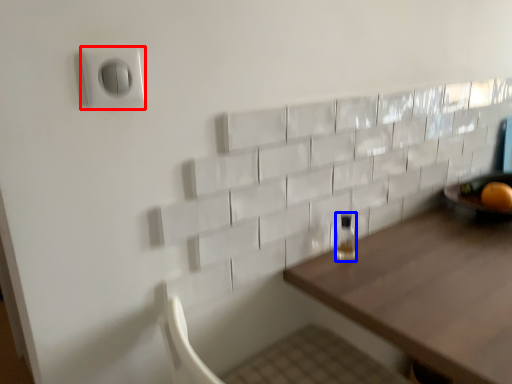
Question: Which object appears closest to the camera in this image, electric outlet (highlighted by a red box) or bottle (highlighted by a blue box)?

Choices:
 (A) electric outlet
 (B) bottle

Answer: (A)